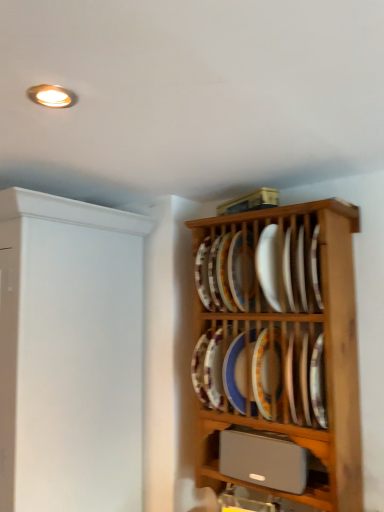
Measure the distance between white glossy plate at center, which ranks as the fifth platter in bottom-to-top order, and camera.

A distance of 4.06 feet exists between white glossy plate at center, which ranks as the fifth platter in bottom-to-top order, and camera.

Locate an element on the screen. The image size is (384, 512). silver metallic speaker at lower center is located at coordinates (245, 481).

How much space does blue glossy platter at center, the fifth platter in the top-to-bottom sequence, occupy horizontally?

blue glossy platter at center, the fifth platter in the top-to-bottom sequence, is 8.64 inches wide.

The width and height of the screenshot is (384, 512). Identify the location of porcelain plate at center, which ranks as the 2th platter in top-to-bottom order. click(x=241, y=270).

The width and height of the screenshot is (384, 512). Identify the location of wooden plate rack at upper right. (280, 360).

How much space does porcelain plate at center, acting as the third platter starting from the bottom, occupy vertically?

porcelain plate at center, acting as the third platter starting from the bottom, is 10.75 inches in height.

What is the approximate height of porcelain plate at center, the 2th platter positioned from the bottom?

It is 27.12 centimeters.

At what (x,y) coordinates should I click in order to perform the action: click on white matte cabinet at left. Please return your answer as a coordinate pair (x, y). This screenshot has width=384, height=512. Looking at the image, I should click on (70, 354).

Considering the positions of objects blue glossy platter at center, the fifth platter in the top-to-bottom sequence, and porcelain plate at center, acting as the 4th platter starting from the top, in the image provided, who is in front, blue glossy platter at center, the fifth platter in the top-to-bottom sequence, or porcelain plate at center, acting as the 4th platter starting from the top,?

porcelain plate at center, acting as the 4th platter starting from the top.

At what (x,y) coordinates should I click in order to perform the action: click on platter below the porcelain plate at center, the 2th platter positioned from the bottom (from the image's perspective). Please return your answer as a coordinate pair (x, y). This screenshot has height=512, width=384. Looking at the image, I should click on (234, 374).

From the picture: Does porcelain plate at center, acting as the 4th platter starting from the top, have a larger size compared to wooden plate rack at upper right?

No, porcelain plate at center, acting as the 4th platter starting from the top, is not bigger than wooden plate rack at upper right.

From the image's perspective, would you say porcelain plate at center, the 2th platter positioned from the bottom, is positioned over wooden plate rack at upper right?

No, from the image's perspective, porcelain plate at center, the 2th platter positioned from the bottom, is not above wooden plate rack at upper right.

Does porcelain plate at center, acting as the 4th platter starting from the top, have a lesser width compared to wooden plate rack at upper right?

Yes, porcelain plate at center, acting as the 4th platter starting from the top, is thinner than wooden plate rack at upper right.

Based on the photo, is porcelain plate at center, acting as the 4th platter starting from the top, inside or outside of wooden plate rack at upper right?

porcelain plate at center, acting as the 4th platter starting from the top, exists entirely within wooden plate rack at upper right.

Does wooden plate rack at upper right turn towards white matte cabinet at left?

No, wooden plate rack at upper right is not turned towards white matte cabinet at left.

In the image, is wooden plate rack at upper right positioned in front of or behind white matte cabinet at left?

Clearly, wooden plate rack at upper right is behind white matte cabinet at left.

Is silver metallic speaker at lower center facing towards white matte cabinet at left?

No, silver metallic speaker at lower center does not turn towards white matte cabinet at left.

In terms of height, does silver metallic speaker at lower center look taller or shorter compared to white matte cabinet at left?

Considering their sizes, silver metallic speaker at lower center has less height than white matte cabinet at left.

Considering the positions of point (199, 438) and point (87, 374), is point (199, 438) closer or farther from the camera than point (87, 374)?

Point (199, 438) is positioned farther from the camera compared to point (87, 374).

Which object is more forward, silver metallic speaker at lower center or white matte cabinet at left?

white matte cabinet at left.

From the picture: Is the position of porcelain plate at center, positioned as the fourth platter in bottom-to-top order, less distant than that of wooden plate rack at upper right?

No, the depth of porcelain plate at center, positioned as the fourth platter in bottom-to-top order, is greater than that of wooden plate rack at upper right.

From a real-world perspective, is porcelain plate at center, which ranks as the 2th platter in top-to-bottom order, under wooden plate rack at upper right?

Incorrect, from a real-world perspective, porcelain plate at center, which ranks as the 2th platter in top-to-bottom order, is higher than wooden plate rack at upper right.

Is point (240, 233) closer or farther from the camera than point (350, 480)?

Point (240, 233) is farther from the camera than point (350, 480).

Consider the image. Can you confirm if porcelain plate at center, positioned as the fourth platter in bottom-to-top order, is smaller than wooden plate rack at upper right?

Yes, porcelain plate at center, positioned as the fourth platter in bottom-to-top order, is smaller than wooden plate rack at upper right.

Is porcelain plate at center, acting as the third platter starting from the bottom, at the back of silver metallic speaker at lower center?

silver metallic speaker at lower center is not turned away from porcelain plate at center, acting as the third platter starting from the bottom.

From the image's perspective, which one is positioned lower, silver metallic speaker at lower center or porcelain plate at center, acting as the third platter starting from the bottom?

silver metallic speaker at lower center appears lower in the image.

From a real-world perspective, which object stands above the other?

In real-world perspective, porcelain plate at center, the 3th platter viewed from the top, is above.

Which of these two, white glossy plate at center, which ranks as the fifth platter in bottom-to-top order, or porcelain plate at center, which ranks as the 2th platter in top-to-bottom order, is wider?

white glossy plate at center, which ranks as the fifth platter in bottom-to-top order.

You are a GUI agent. You are given a task and a screenshot of the screen. Output one action in this format:
    pyautogui.click(x=<x>, y=<y>)
    Task: Click on the platter that is the 1st one when counting downward from the white glossy plate at center, placed as the 1th platter when sorted from top to bottom (from the image's perspective)
    This screenshot has height=512, width=384.
    Given the screenshot: What is the action you would take?
    pyautogui.click(x=241, y=270)

Considering the relative positions of white glossy plate at center, which ranks as the fifth platter in bottom-to-top order, and porcelain plate at center, positioned as the fourth platter in bottom-to-top order, in the image provided, is white glossy plate at center, which ranks as the fifth platter in bottom-to-top order, in front of porcelain plate at center, positioned as the fourth platter in bottom-to-top order,?

Yes, it is in front of porcelain plate at center, positioned as the fourth platter in bottom-to-top order.

Identify the location of platter that is the 4th one when counting backward from the porcelain plate at center, acting as the 4th platter starting from the top. (234, 374).

Locate an element on the screen. This screenshot has height=512, width=384. cupboard to the left of porcelain plate at center, acting as the 4th platter starting from the top is located at coordinates (280, 360).

Based on their spatial positions, is porcelain plate at center, which ranks as the 2th platter in top-to-bottom order, or white matte cabinet at left closer to blue glossy platter at center, the fifth platter in the top-to-bottom sequence?

porcelain plate at center, which ranks as the 2th platter in top-to-bottom order, is positioned closer to the anchor blue glossy platter at center, the fifth platter in the top-to-bottom sequence.

Estimate the real-world distances between objects in this image. Which object is closer to porcelain plate at center, positioned as the fourth platter in bottom-to-top order, silver metallic speaker at lower center or white matte cabinet at left?

Based on the image, silver metallic speaker at lower center appears to be nearer to porcelain plate at center, positioned as the fourth platter in bottom-to-top order.

Looking at the image, which one is located closer to porcelain plate at center, the 3th platter viewed from the top, wooden plate rack at upper right or white glossy plate at center, which ranks as the fifth platter in bottom-to-top order?

wooden plate rack at upper right is closer to porcelain plate at center, the 3th platter viewed from the top.

Considering their positions, is porcelain plate at center, positioned as the fourth platter in bottom-to-top order, positioned closer to white glossy plate at center, placed as the 1th platter when sorted from top to bottom, than porcelain plate at center, acting as the 4th platter starting from the top?

The object closer to white glossy plate at center, placed as the 1th platter when sorted from top to bottom, is porcelain plate at center, positioned as the fourth platter in bottom-to-top order.

From the picture: Considering their positions, is blue glossy platter at center, the fifth platter in the top-to-bottom sequence, positioned further to white matte cabinet at left than porcelain plate at center, positioned as the fourth platter in bottom-to-top order?

porcelain plate at center, positioned as the fourth platter in bottom-to-top order, is further to white matte cabinet at left.

Estimate the real-world distances between objects in this image. Which object is closer to porcelain plate at center, the 2th platter positioned from the bottom, white matte cabinet at left or blue glossy platter at center, the fifth platter in the top-to-bottom sequence?

blue glossy platter at center, the fifth platter in the top-to-bottom sequence, lies closer to porcelain plate at center, the 2th platter positioned from the bottom, than the other object.

Based on their spatial positions, is blue glossy platter at center, the first platter in the bottom-to-top sequence, or white glossy plate at center, placed as the 1th platter when sorted from top to bottom, closer to silver metallic speaker at lower center?

blue glossy platter at center, the first platter in the bottom-to-top sequence, is positioned closer to the anchor silver metallic speaker at lower center.

Considering their positions, is silver metallic speaker at lower center positioned closer to white glossy plate at center, placed as the 1th platter when sorted from top to bottom, than porcelain plate at center, positioned as the fourth platter in bottom-to-top order?

porcelain plate at center, positioned as the fourth platter in bottom-to-top order, lies closer to white glossy plate at center, placed as the 1th platter when sorted from top to bottom, than the other object.

This screenshot has height=512, width=384. In order to click on platter between white glossy plate at center, which ranks as the fifth platter in bottom-to-top order, and wooden plate rack at upper right from top to bottom in this screenshot , I will do `click(241, 270)`.

The width and height of the screenshot is (384, 512). I want to click on platter between white matte cabinet at left and blue glossy platter at center, the first platter in the bottom-to-top sequence, from left to right, so click(241, 270).

Identify the location of platter that lies between porcelain plate at center, positioned as the fourth platter in bottom-to-top order, and porcelain plate at center, acting as the 4th platter starting from the top, from top to bottom. (267, 372).

Where is `cupboard between white glossy plate at center, placed as the 1th platter when sorted from top to bottom, and silver metallic speaker at lower center in the up-down direction`? Image resolution: width=384 pixels, height=512 pixels. cupboard between white glossy plate at center, placed as the 1th platter when sorted from top to bottom, and silver metallic speaker at lower center in the up-down direction is located at coordinates (280, 360).